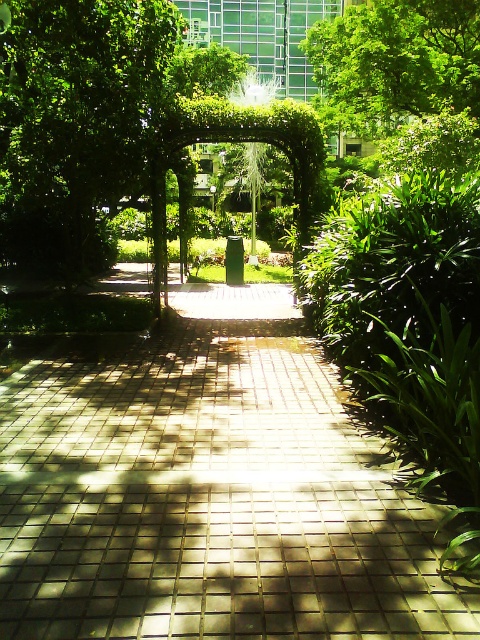
Question: Which object appears closest to the camera in this image?

Choices:
 (A) brick paved walkway at center
 (B) green leafy tree at upper center

Answer: (A)

Question: Which object is farther from the camera taking this photo?

Choices:
 (A) brick paved walkway at center
 (B) green leafy tree at upper center

Answer: (B)

Question: Which point is farther to the camera?

Choices:
 (A) (123, 452)
 (B) (55, 227)

Answer: (B)

Question: Can you confirm if brick paved walkway at center is smaller than green leafy tree at upper center?

Choices:
 (A) no
 (B) yes

Answer: (B)

Question: Where is brick paved walkway at center located in relation to green leafy tree at center in the image?

Choices:
 (A) left
 (B) right

Answer: (B)

Question: Does brick paved walkway at center appear on the right side of green leafy tree at center?

Choices:
 (A) yes
 (B) no

Answer: (A)